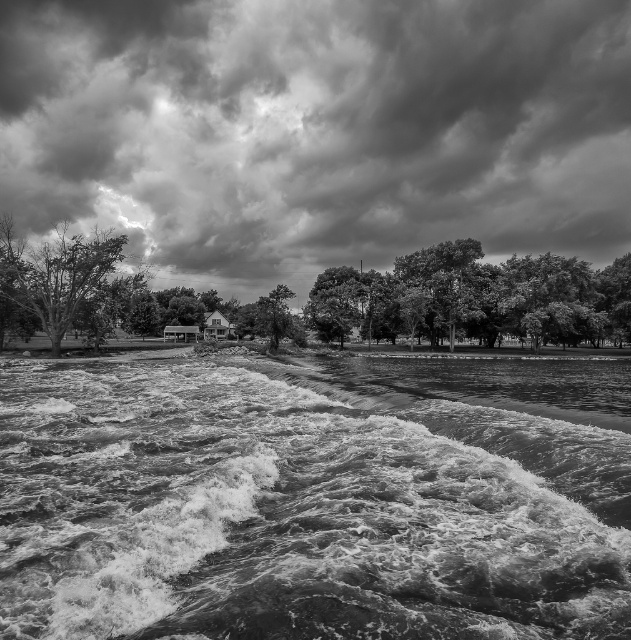
Can you confirm if smooth bark tree at left is positioned below smooth bark tree at center?

No.

The width and height of the screenshot is (631, 640). Describe the element at coordinates (56, 273) in the screenshot. I see `smooth bark tree at left` at that location.

Identify the location of smooth bark tree at left. The height and width of the screenshot is (640, 631). (56, 273).

Consider the image. Is smooth green trees at center in front of smooth bark tree at left?

No, it is not.

Image resolution: width=631 pixels, height=640 pixels. Describe the element at coordinates (475, 298) in the screenshot. I see `smooth green trees at center` at that location.

In order to click on smooth green trees at center in this screenshot , I will do `click(475, 298)`.

Does rough water at lower center lie in front of smooth bark tree at left?

Yes.

Does rough water at lower center have a lesser height compared to smooth bark tree at left?

Yes, rough water at lower center is shorter than smooth bark tree at left.

Is point (596, 534) in front of point (126, 237)?

Yes, it is in front of point (126, 237).

Where is `rough water at lower center`? Image resolution: width=631 pixels, height=640 pixels. rough water at lower center is located at coordinates click(x=314, y=499).